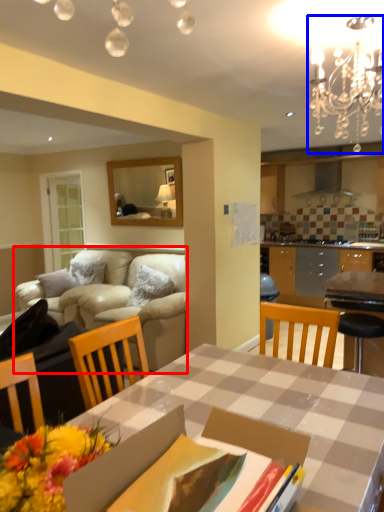
Question: Which object appears closest to the camera in this image, studio couch (highlighted by a red box) or light fixture (highlighted by a blue box)?

Choices:
 (A) studio couch
 (B) light fixture

Answer: (B)